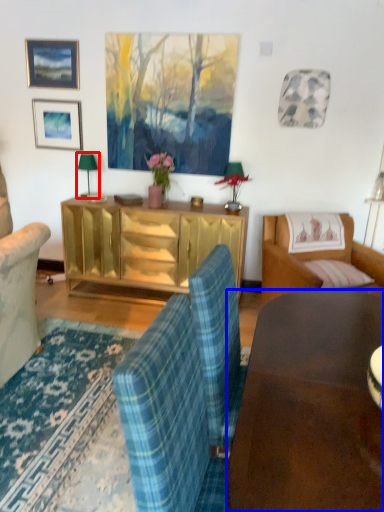
Question: Which point is closer to the camera, lamp (highlighted by a red box) or desk (highlighted by a blue box)?

Choices:
 (A) lamp
 (B) desk

Answer: (B)